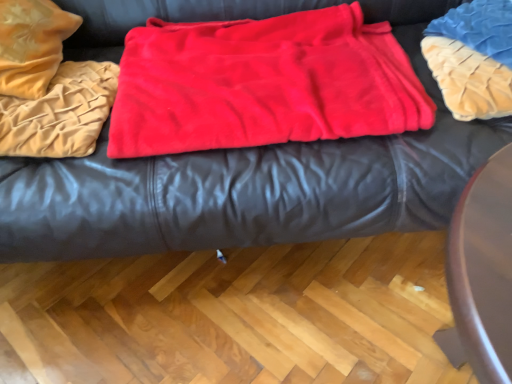
Question: From the image's perspective, is blue textured pillow at upper right beneath red fleece blanket at center, marked as the 1th blanket in a right-to-left arrangement?

Choices:
 (A) yes
 (B) no

Answer: (B)

Question: Is blue textured pillow at upper right positioned with its back to red fleece blanket at center, marked as the 1th blanket in a right-to-left arrangement?

Choices:
 (A) no
 (B) yes

Answer: (A)

Question: Considering the relative positions of blue textured pillow at upper right and red fleece blanket at center, marked as the 1th blanket in a right-to-left arrangement, in the image provided, is blue textured pillow at upper right to the right of red fleece blanket at center, marked as the 1th blanket in a right-to-left arrangement, from the viewer's perspective?

Choices:
 (A) no
 (B) yes

Answer: (B)

Question: Does blue textured pillow at upper right have a smaller size compared to red fleece blanket at center, which is the second blanket from left to right?

Choices:
 (A) no
 (B) yes

Answer: (B)

Question: Can you confirm if blue textured pillow at upper right is taller than red fleece blanket at center, marked as the 1th blanket in a right-to-left arrangement?

Choices:
 (A) yes
 (B) no

Answer: (A)

Question: Is red fleece blanket at center, which is the second blanket from left to right, wider or thinner than velvet-like red blanket at center?

Choices:
 (A) wide
 (B) thin

Answer: (B)

Question: Based on their sizes in the image, would you say red fleece blanket at center, marked as the 1th blanket in a right-to-left arrangement, is bigger or smaller than velvet-like red blanket at center?

Choices:
 (A) small
 (B) big

Answer: (A)

Question: In the image, is red fleece blanket at center, marked as the 1th blanket in a right-to-left arrangement, positioned in front of or behind velvet-like red blanket at center?

Choices:
 (A) behind
 (B) front

Answer: (A)

Question: Is red fleece blanket at center, which is the second blanket from left to right, spatially inside velvet-like red blanket at center, or outside of it?

Choices:
 (A) inside
 (B) outside

Answer: (A)

Question: In terms of size, does red fleece blanket at center, marked as the 1th blanket in a right-to-left arrangement, appear bigger or smaller than velvet beige blanket at left, placed as the second blanket when sorted from right to left?

Choices:
 (A) small
 (B) big

Answer: (B)

Question: From a real-world perspective, is red fleece blanket at center, which is the second blanket from left to right, positioned above or below velvet beige blanket at left, placed as the second blanket when sorted from right to left?

Choices:
 (A) below
 (B) above

Answer: (A)

Question: In terms of width, does red fleece blanket at center, which is the second blanket from left to right, look wider or thinner when compared to velvet beige blanket at left, placed as the second blanket when sorted from right to left?

Choices:
 (A) thin
 (B) wide

Answer: (B)

Question: Based on their positions, is red fleece blanket at center, which is the second blanket from left to right, located to the left or right of velvet beige blanket at left, the 1th blanket in the left-to-right sequence?

Choices:
 (A) left
 (B) right

Answer: (B)

Question: In terms of width, does velvet beige blanket at left, the 1th blanket in the left-to-right sequence, look wider or thinner when compared to red fleece blanket at center, marked as the 1th blanket in a right-to-left arrangement?

Choices:
 (A) thin
 (B) wide

Answer: (A)

Question: Is velvet beige blanket at left, the 1th blanket in the left-to-right sequence, in front of or behind red fleece blanket at center, marked as the 1th blanket in a right-to-left arrangement, in the image?

Choices:
 (A) behind
 (B) front

Answer: (A)